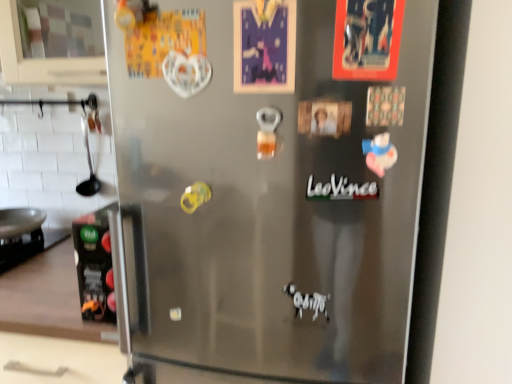
Question: From a real-world perspective, is black matte carton at left located higher than black matte text at center?

Choices:
 (A) no
 (B) yes

Answer: (A)

Question: Does black matte carton at left come in front of black matte text at center?

Choices:
 (A) no
 (B) yes

Answer: (A)

Question: Does black matte carton at left turn towards black matte text at center?

Choices:
 (A) yes
 (B) no

Answer: (B)

Question: From the image's perspective, would you say black matte carton at left is shown under black matte text at center?

Choices:
 (A) yes
 (B) no

Answer: (A)

Question: Is black matte carton at left smaller than black matte text at center?

Choices:
 (A) no
 (B) yes

Answer: (A)

Question: Looking at the image, does satin silver fridge at center seem bigger or smaller compared to black matte text at center?

Choices:
 (A) big
 (B) small

Answer: (A)

Question: Looking at their shapes, would you say satin silver fridge at center is wider or thinner than black matte text at center?

Choices:
 (A) wide
 (B) thin

Answer: (A)

Question: In the image, is satin silver fridge at center on the left side or the right side of black matte text at center?

Choices:
 (A) left
 (B) right

Answer: (A)

Question: In terms of height, does satin silver fridge at center look taller or shorter compared to black matte text at center?

Choices:
 (A) short
 (B) tall

Answer: (B)

Question: Relative to black matte carton at left, is black matte text at center in front or behind?

Choices:
 (A) behind
 (B) front

Answer: (B)

Question: From their relative heights in the image, would you say black matte text at center is taller or shorter than black matte carton at left?

Choices:
 (A) short
 (B) tall

Answer: (A)

Question: Considering the positions of black matte text at center and black matte carton at left in the image, is black matte text at center wider or thinner than black matte carton at left?

Choices:
 (A) thin
 (B) wide

Answer: (A)

Question: Considering the positions of point (359, 190) and point (96, 297), is point (359, 190) closer or farther from the camera than point (96, 297)?

Choices:
 (A) closer
 (B) farther

Answer: (A)

Question: Visually, is black matte carton at left positioned to the left or to the right of satin silver fridge at center?

Choices:
 (A) right
 (B) left

Answer: (B)

Question: Looking at the image, does black matte carton at left seem bigger or smaller compared to satin silver fridge at center?

Choices:
 (A) small
 (B) big

Answer: (A)